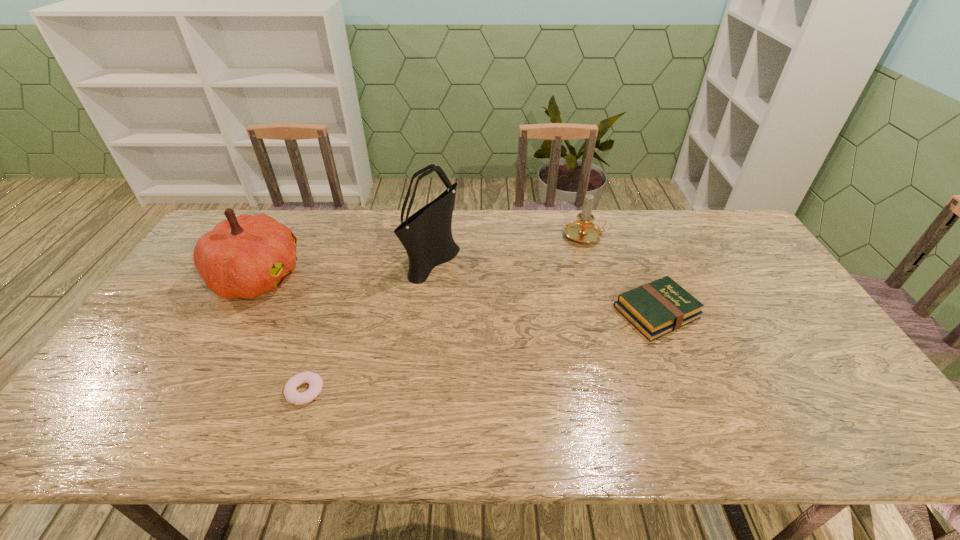
In order to click on vacant space located 0.240m on the left of the candle in this screenshot , I will do `click(494, 236)`.

Where is `vacant space located 0.120m on the right of the book`? vacant space located 0.120m on the right of the book is located at coordinates (740, 312).

Where is `vacant position located 0.390m on the right of the doughnut`? vacant position located 0.390m on the right of the doughnut is located at coordinates point(484,390).

Find the location of a particular element. The image size is (960, 540). shoulder bag that is at the far edge is located at coordinates (426, 235).

In order to click on pumpkin at the far edge in this screenshot , I will do `click(244, 256)`.

The height and width of the screenshot is (540, 960). Identify the location of candle that is at the far edge. (583, 230).

Find the location of a particular element. The height and width of the screenshot is (540, 960). object positioned at the left edge is located at coordinates (244, 256).

You are a GUI agent. You are given a task and a screenshot of the screen. Output one action in this format:
    pyautogui.click(x=<x>, y=<y>)
    Task: Click on the object present at the far left corner
    The image size is (960, 540).
    Given the screenshot: What is the action you would take?
    pyautogui.click(x=244, y=256)

In the image, there is a desktop. In order to click on blank space at the far edge in this screenshot , I will do point(567,212).

In the image, there is a desktop. Identify the location of vacant area at the near edge. Image resolution: width=960 pixels, height=540 pixels. (356, 414).